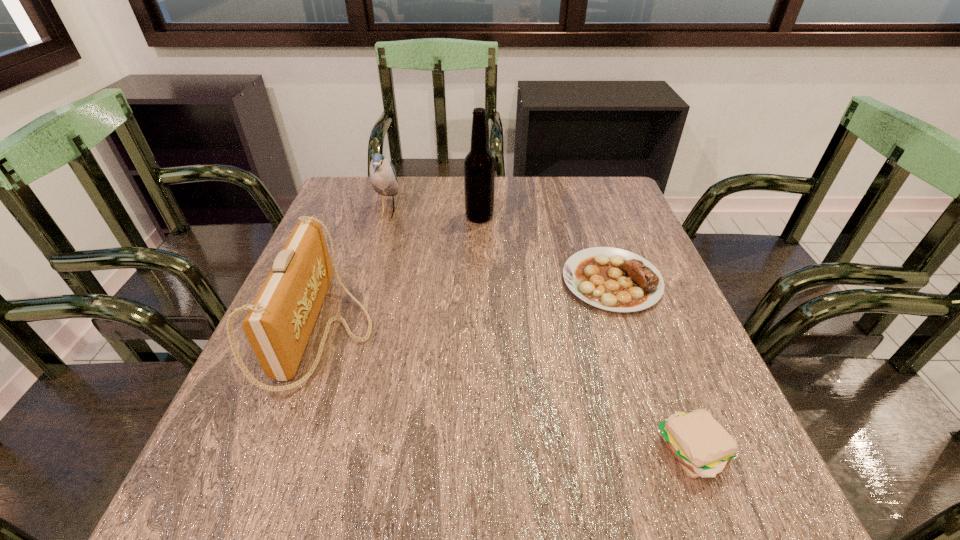
Where is `vacant space located 0.280m on the back of the second shortest object`? The height and width of the screenshot is (540, 960). vacant space located 0.280m on the back of the second shortest object is located at coordinates (636, 304).

At what (x,y) coordinates should I click in order to perform the action: click on vacant area situated 0.090m on the front of the shortest object. Please return your answer as a coordinate pair (x, y). Looking at the image, I should click on (635, 349).

You are a GUI agent. You are given a task and a screenshot of the screen. Output one action in this format:
    pyautogui.click(x=<x>, y=<y>)
    Task: Click on the beer bottle that is at the far edge
    
    Given the screenshot: What is the action you would take?
    pyautogui.click(x=479, y=165)

The image size is (960, 540). In order to click on bird that is at the far edge in this screenshot , I will do `click(383, 178)`.

The image size is (960, 540). In order to click on object that is at the near edge in this screenshot , I will do `click(701, 445)`.

The height and width of the screenshot is (540, 960). I want to click on bird at the left edge, so click(383, 178).

Where is `handbag located in the left edge section of the desktop`? The image size is (960, 540). handbag located in the left edge section of the desktop is located at coordinates (278, 325).

What are the coordinates of `patty positioned at the right edge` in the screenshot? It's located at (701, 445).

Locate an element on the screen. steak located in the right edge section of the desktop is located at coordinates (613, 279).

The height and width of the screenshot is (540, 960). What are the coordinates of `object that is positioned at the far left corner` in the screenshot? It's located at (383, 178).